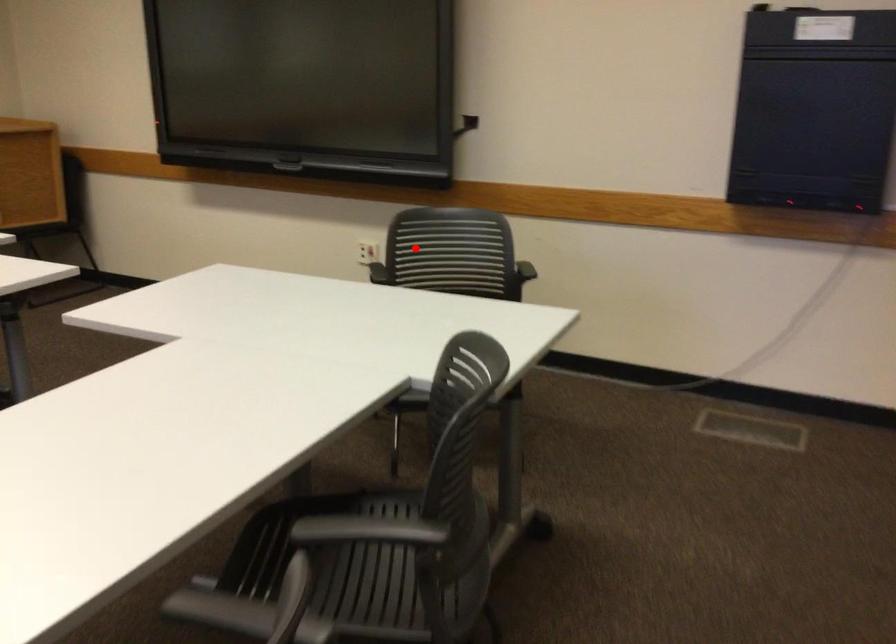
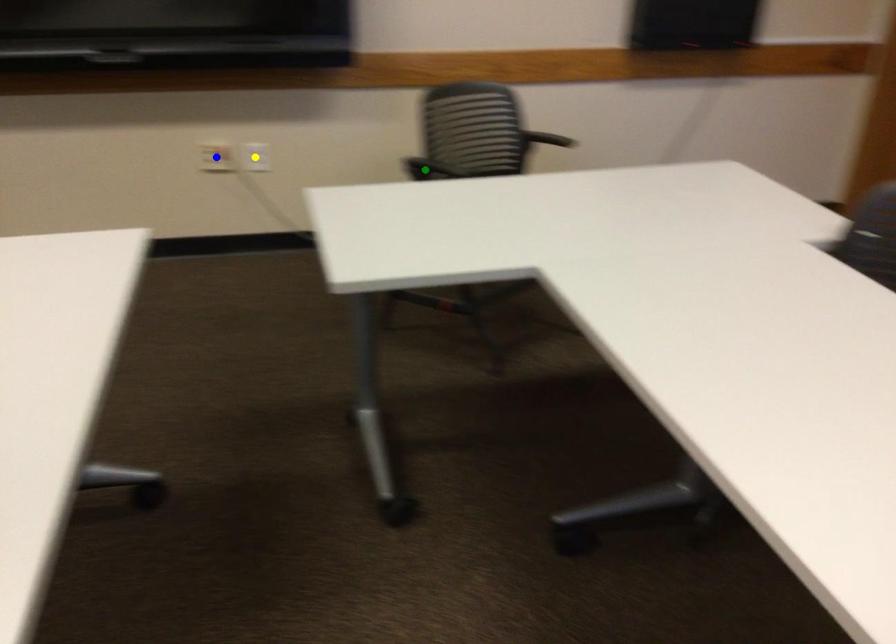
Question: I am providing you with two images of the same scene from different viewpoints. A red point is marked on the first image. You are given multiple points on the second image. Which spot in image 2 lines up with the point in image 1?

Choices:
 (A) yellow point
 (B) green point
 (C) blue point

Answer: (C)